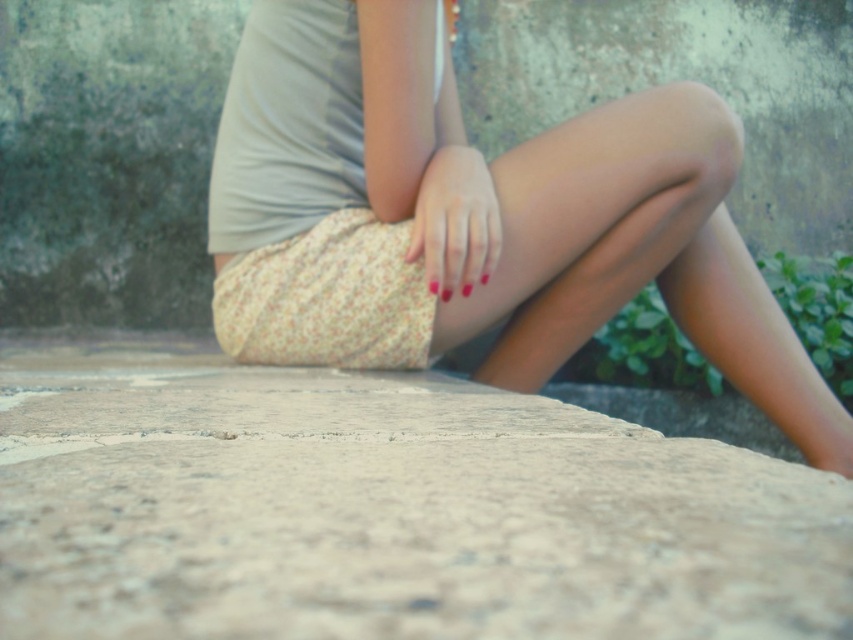
You are an artist trying to sketch this scene. You need to decide which point to focus on first based on their depth. Which of the two points, point (366,616) or point (422,252), is closer to you?

Point (366,616) is closer to the viewer than point (422,252), so you should focus on point (366,616) first.

You are a photographer setting up a shot of the scene. The subject is sitting on the smooth stone surface at center with their smooth matte hand at center resting on their knee. To ensure the hand is in focus while the stone surface is slightly blurred, where should you adjust the focus?

You should focus on the smooth matte hand at center since it is above the smooth stone surface at center, allowing the stone surface to be slightly out of focus while keeping the hand sharp.

You are a photographer setting up a shoot. You see the smooth stone surface at center and the floral fabric skirt at center in the scene. Which object is located below the other?

The smooth stone surface at center is positioned under the floral fabric skirt at center.